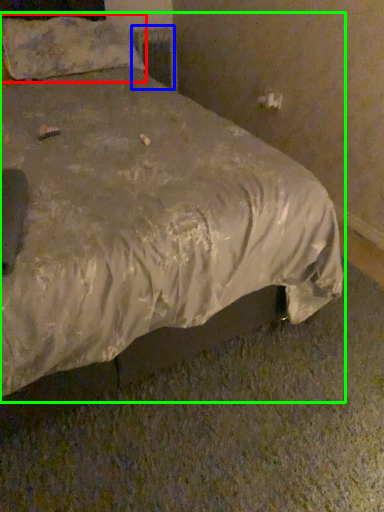
Question: Which object is the farthest from pillow (highlighted by a red box)? Choose among these: radiator (highlighted by a blue box) or bed (highlighted by a green box).

Choices:
 (A) radiator
 (B) bed

Answer: (A)